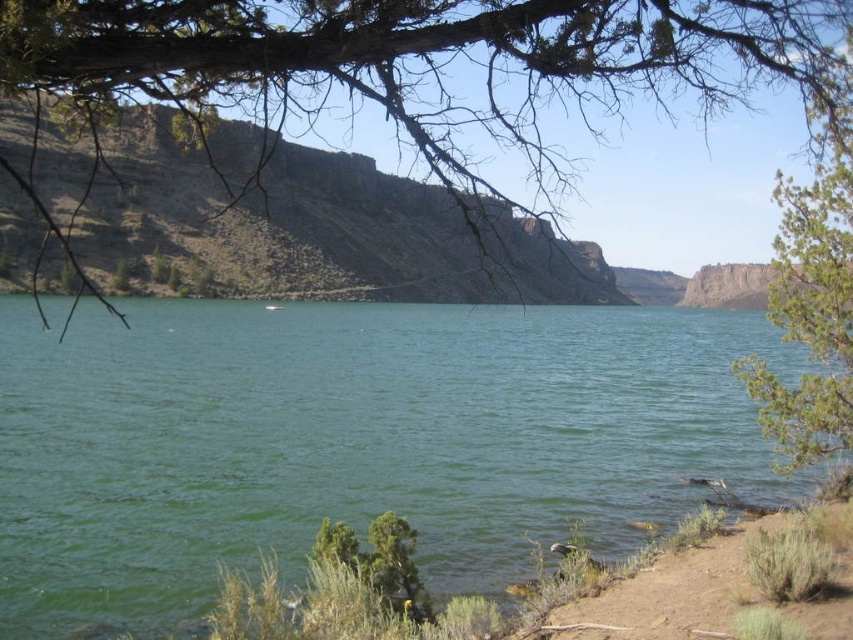
Does brown rocky cliff at upper center have a greater width compared to brown dirt at lower right?

Indeed, brown rocky cliff at upper center has a greater width compared to brown dirt at lower right.

Who is shorter, brown rocky cliff at upper center or brown dirt at lower right?

Standing shorter between the two is brown dirt at lower right.

Is point (167, 138) positioned in front of point (569, 604)?

No, it is not.

Where is `brown rocky cliff at upper center`? The image size is (853, 640). brown rocky cliff at upper center is located at coordinates [312, 230].

Does brown dirt at lower right come behind rugged rock cliff at upper right?

No, brown dirt at lower right is in front of rugged rock cliff at upper right.

Consider the image. Can you confirm if brown dirt at lower right is smaller than rugged rock cliff at upper right?

Indeed, brown dirt at lower right has a smaller size compared to rugged rock cliff at upper right.

Is point (633, 620) positioned in front of point (749, 307)?

Yes, it is.

This screenshot has width=853, height=640. What are the coordinates of `brown dirt at lower right` in the screenshot? It's located at (728, 586).

Who is positioned more to the right, green water at center or brown rocky cliff at upper center?

From the viewer's perspective, brown rocky cliff at upper center appears more on the right side.

Can you confirm if green water at center is taller than brown rocky cliff at upper center?

In fact, green water at center may be shorter than brown rocky cliff at upper center.

The image size is (853, 640). In order to click on green water at center in this screenshot , I will do `click(352, 440)`.